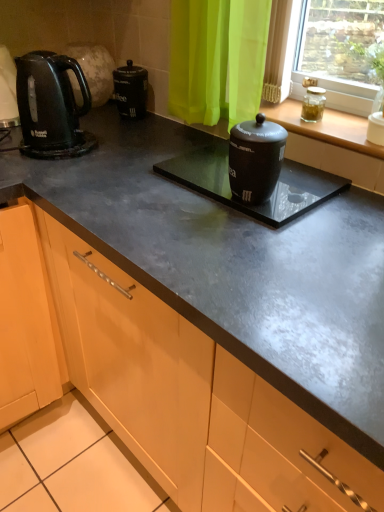
Image resolution: width=384 pixels, height=512 pixels. I want to click on blank space to the left of clear glass jar at upper right, which ranks as the 1th appliance in top-to-bottom order, so click(x=283, y=114).